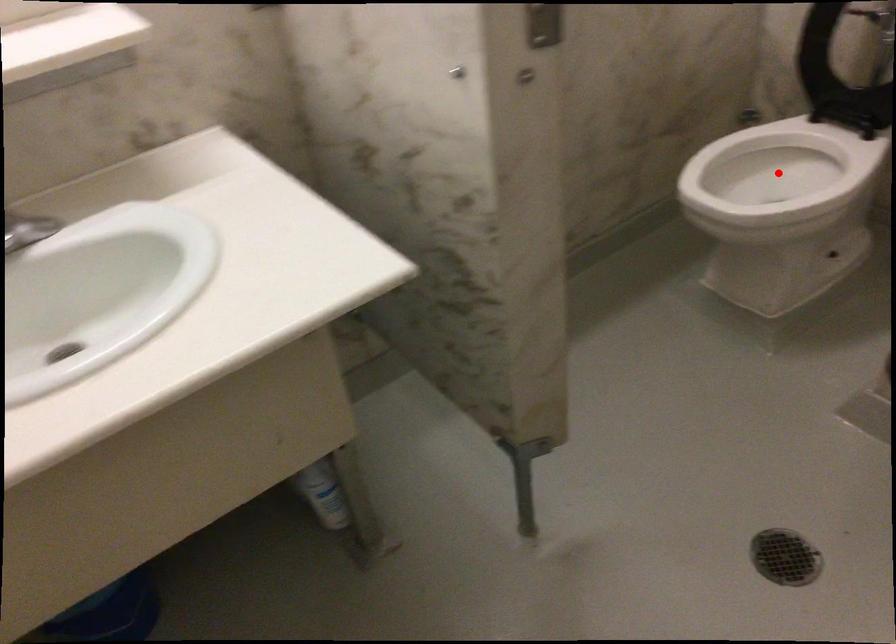
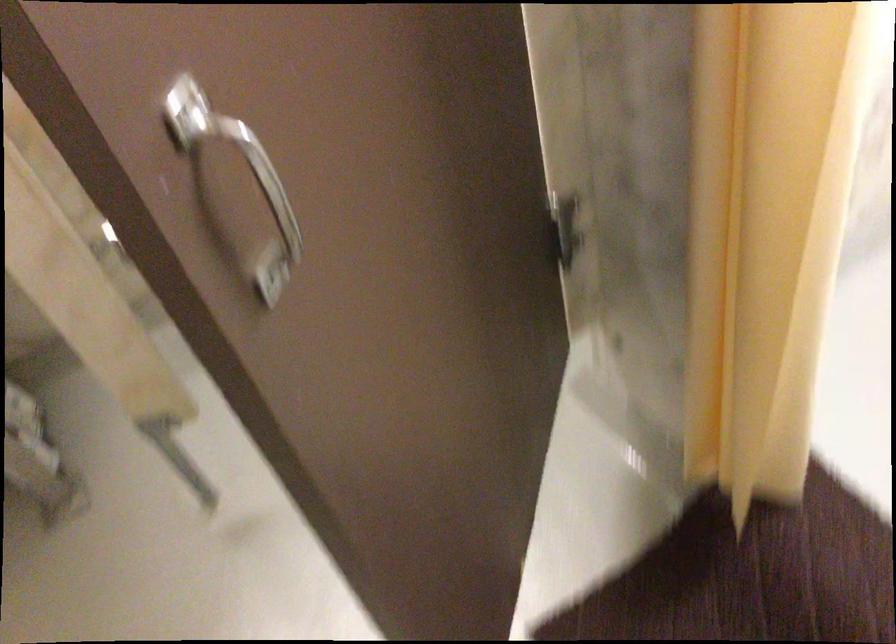
Question: I am providing you with two images of the same scene from different viewpoints. A red point is marked on the first image. Can you still see the location of the red point in image 2?

Choices:
 (A) Yes
 (B) No

Answer: (B)